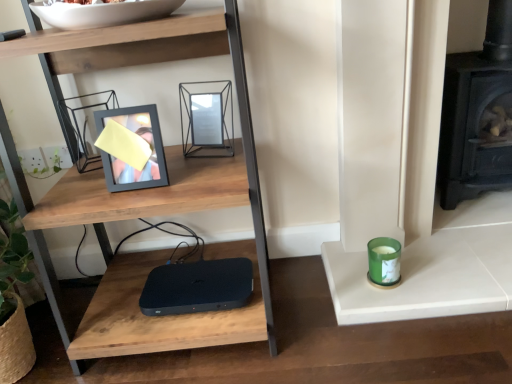
The width and height of the screenshot is (512, 384). I want to click on empty space that is to the right of woodenmaterial/textureshelf at center, so click(x=333, y=321).